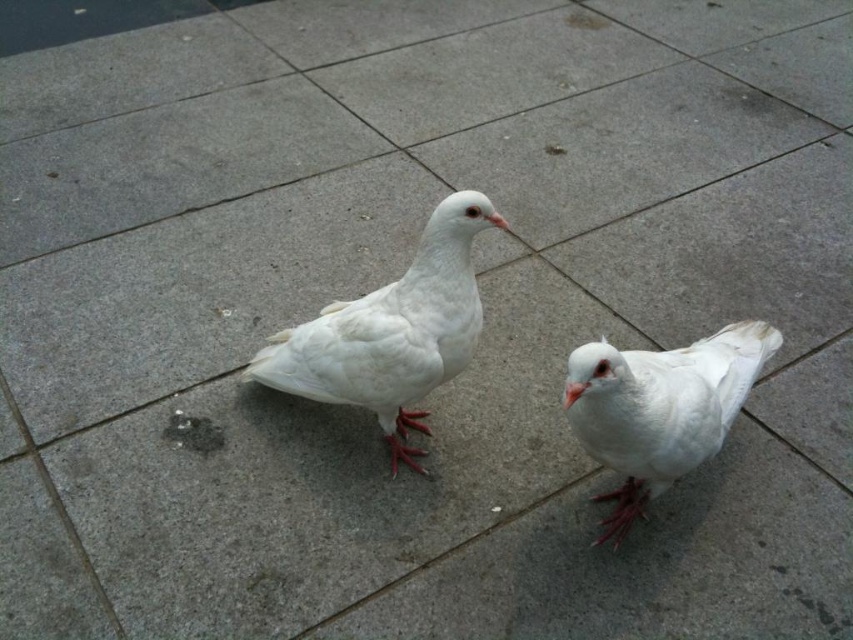
You are a photographer trying to capture a closeup shot of the white matte beak at center. You notice the white matte pigeon at center is blocking your view. Can you move the pigeon to get a clear shot of the beak?

The white matte pigeon at center is closer to the viewer than the white matte beak at center, so moving the pigeon would allow you to see the beak clearly.

You are a birdwatcher observing the scene. You notice the white matte bird at center and the orange matte beak at center. Which object is positioned higher in the image?

The white matte bird at center is positioned higher than the orange matte beak at center in the image.